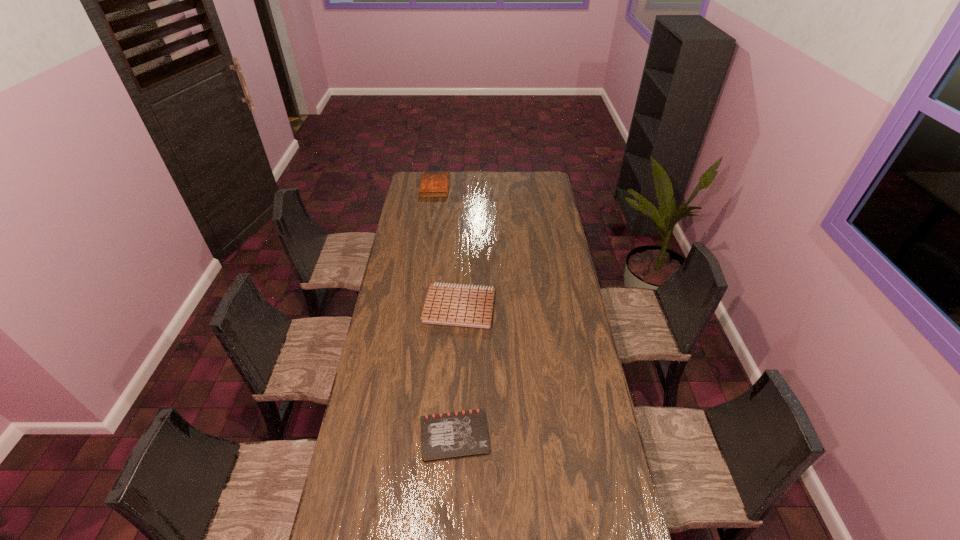
Locate an element on the screen. The image size is (960, 540). vacant space that satisfies the following two spatial constraints: 1. on the spine side of the tallest object; 2. on the back side of the second nearest object is located at coordinates (419, 307).

Identify the location of free location that satisfies the following two spatial constraints: 1. on the spine side of the nearer notebook; 2. on the right side of the tallest object. This screenshot has width=960, height=540. (400, 436).

Locate an element on the screen. This screenshot has height=540, width=960. free space that satisfies the following two spatial constraints: 1. on the back side of the nearer notebook; 2. on the spine side of the farthest object is located at coordinates (466, 187).

Locate an element on the screen. The image size is (960, 540). vacant point that satisfies the following two spatial constraints: 1. on the back side of the shorter notebook; 2. on the spine side of the tallest object is located at coordinates (466, 187).

Where is `vacant region that satisfies the following two spatial constraints: 1. on the spine side of the tallest object; 2. on the back side of the nearest object`? The width and height of the screenshot is (960, 540). vacant region that satisfies the following two spatial constraints: 1. on the spine side of the tallest object; 2. on the back side of the nearest object is located at coordinates (400, 436).

The image size is (960, 540). Identify the location of vacant position in the image that satisfies the following two spatial constraints: 1. on the spine side of the Bible; 2. on the back side of the shorter notebook. (400, 436).

Where is `vacant space that satisfies the following two spatial constraints: 1. on the spine side of the farthest object; 2. on the left side of the nearer notebook`? The width and height of the screenshot is (960, 540). vacant space that satisfies the following two spatial constraints: 1. on the spine side of the farthest object; 2. on the left side of the nearer notebook is located at coordinates (400, 436).

This screenshot has width=960, height=540. In order to click on vacant space that satisfies the following two spatial constraints: 1. on the spine side of the nearer notebook; 2. on the left side of the farthest object in this screenshot , I will do `click(400, 436)`.